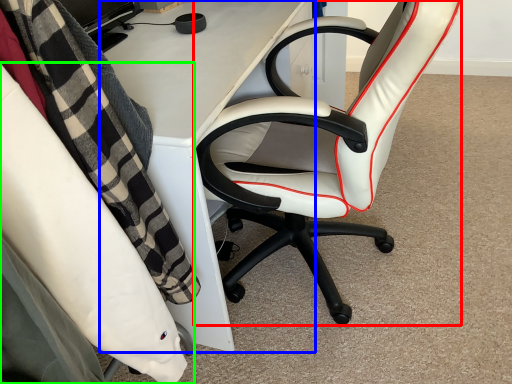
Question: Estimate the real-world distances between objects in this image. Which object is farther from chair (highlighted by a red box), desk (highlighted by a blue box) or chair (highlighted by a green box)?

Choices:
 (A) desk
 (B) chair

Answer: (B)